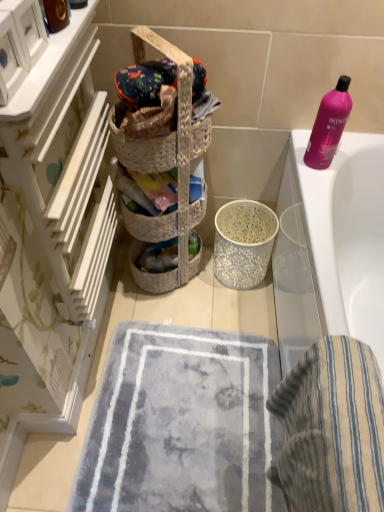
Find the location of a particular element. empty space that is ontop of woven straw basket at center (from a real-world perspective) is located at coordinates (162, 80).